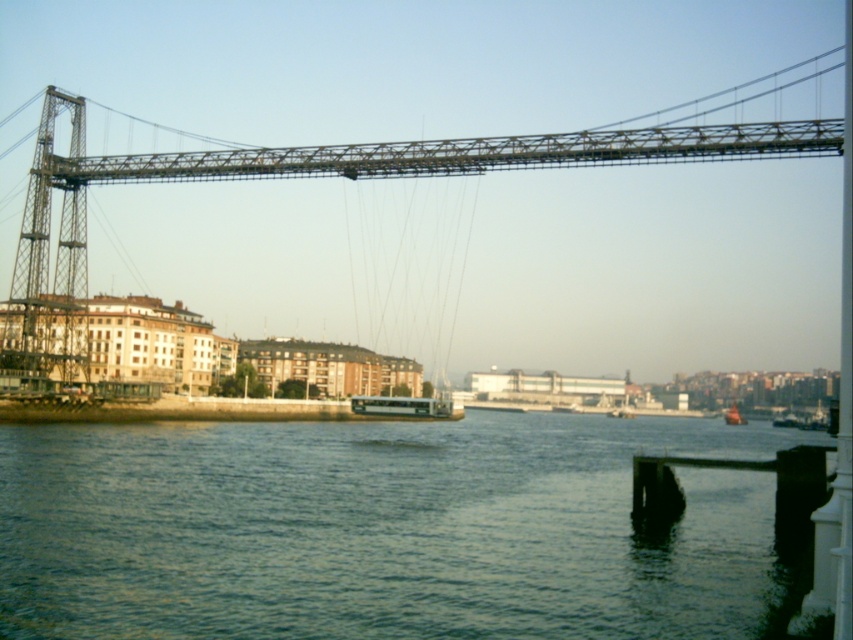
Question: Does greenish water at center appear on the left side of dark wood dock at lower right?

Choices:
 (A) yes
 (B) no

Answer: (A)

Question: Is dark wood dock at lower right further to camera compared to white matte boat at center?

Choices:
 (A) yes
 (B) no

Answer: (B)

Question: Which of the following is the farthest from the observer?

Choices:
 (A) (727, 412)
 (B) (392, 620)

Answer: (A)

Question: Is the position of greenish water at center more distant than that of metallic orange boat at lower right?

Choices:
 (A) no
 (B) yes

Answer: (A)

Question: Which point is closer to the camera taking this photo?

Choices:
 (A) (x=376, y=412)
 (B) (x=679, y=576)
 (C) (x=641, y=502)
 (D) (x=547, y=138)

Answer: (B)

Question: Estimate the real-world distances between objects in this image. Which object is farther from the white matte boat at center?

Choices:
 (A) metallic orange boat at lower right
 (B) metallic gray suspension bridge at upper center
 (C) greenish water at center
 (D) dark wood dock at lower right

Answer: (D)